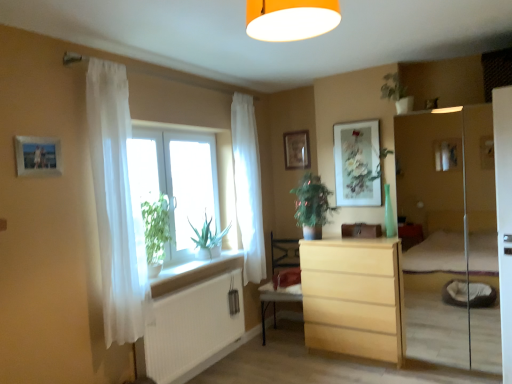
Locate an element on the screen. vacant space situated above white ribbed radiator at lower left (from a real-world perspective) is located at coordinates (192, 282).